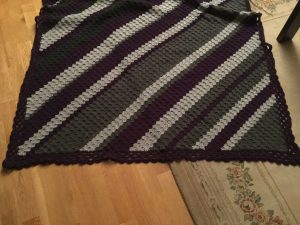
The image size is (300, 225). Find the location of `blanket`. blanket is located at coordinates (157, 59).